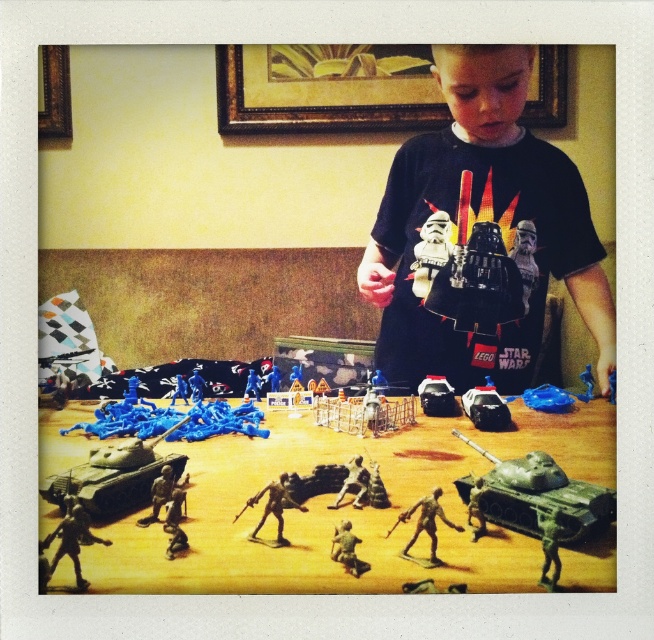
From the picture: You are trying to place a new toy car on the table but need to ensure there is enough space. You see the metallic silver soldier at lower left and the green plastic tank at center. Which object requires more horizontal space to accommodate?

The metallic silver soldier at lower left might be wider than the green plastic tank at center, so it likely requires more horizontal space.

You are a parent observing your child playing with the metallic silver soldier at center and the metallic silver toy soldier at center. Which one is taller?

The metallic silver soldier at center is taller than the metallic silver toy soldier at center.